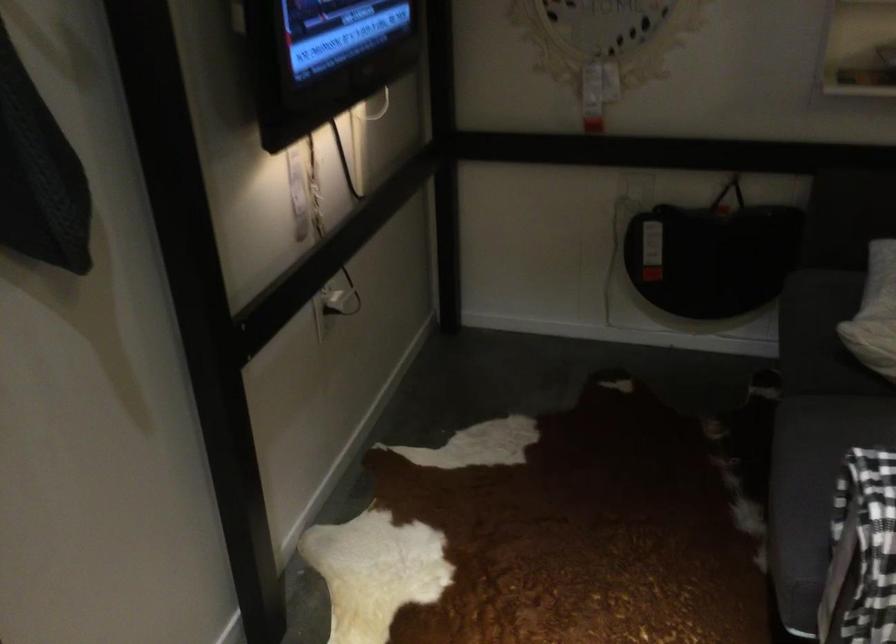
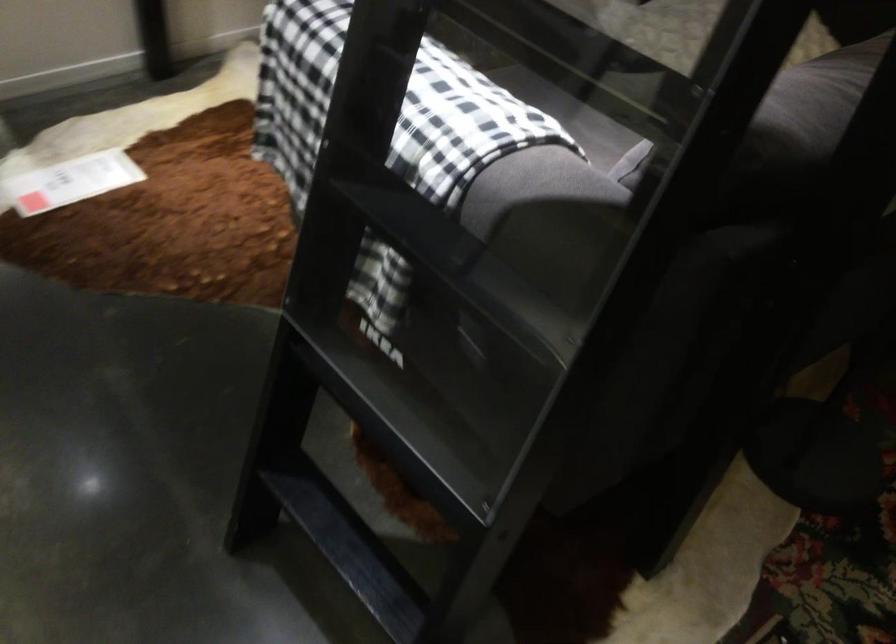
Question: I am providing you with two images of the same scene from different viewpoints. After the viewpoint changes to image2, which objects are now occluded?

Choices:
 (A) grey dish brush
 (B) black ladder rung
 (C) sofa sitting surface
 (D) sofa armrest

Answer: (C)